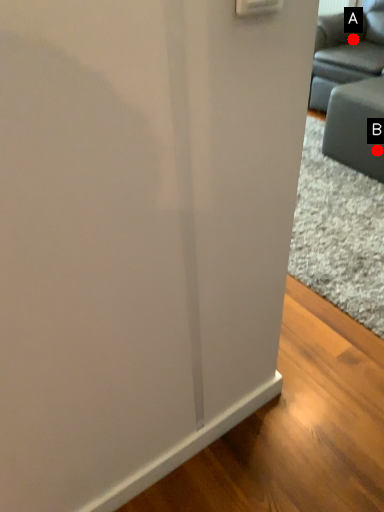
Question: Two points are circled on the image, labeled by A and B beside each circle. Which point is further to the camera?

Choices:
 (A) A is further
 (B) B is further

Answer: (A)